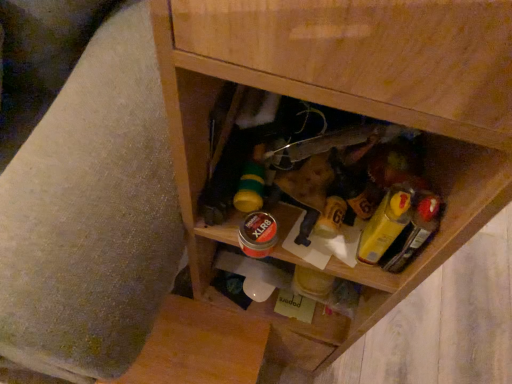
Question: Considering the relative sizes of yellow plastic mustard at center right and wooden swivel chair at lower right in the image provided, is yellow plastic mustard at center right taller than wooden swivel chair at lower right?

Choices:
 (A) no
 (B) yes

Answer: (A)

Question: Can you confirm if yellow plastic mustard at center right is wider than wooden swivel chair at lower right?

Choices:
 (A) yes
 (B) no

Answer: (B)

Question: Could you tell me if yellow plastic mustard at center right is turned towards wooden swivel chair at lower right?

Choices:
 (A) no
 (B) yes

Answer: (A)

Question: Is yellow plastic mustard at center right shorter than wooden swivel chair at lower right?

Choices:
 (A) yes
 (B) no

Answer: (A)

Question: Can you confirm if yellow plastic mustard at center right is bigger than wooden swivel chair at lower right?

Choices:
 (A) yes
 (B) no

Answer: (B)

Question: In terms of width, does wooden swivel chair at lower right look wider or thinner when compared to wooden cabinet at center?

Choices:
 (A) thin
 (B) wide

Answer: (B)

Question: Considering the positions of wooden swivel chair at lower right and wooden cabinet at center in the image, is wooden swivel chair at lower right bigger or smaller than wooden cabinet at center?

Choices:
 (A) big
 (B) small

Answer: (A)

Question: Do you think wooden swivel chair at lower right is within wooden cabinet at center, or outside of it?

Choices:
 (A) outside
 (B) inside

Answer: (A)

Question: In the image, is wooden swivel chair at lower right on the left side or the right side of wooden cabinet at center?

Choices:
 (A) left
 (B) right

Answer: (A)

Question: Would you say wooden cabinet at center is to the left or to the right of wooden swivel chair at lower right in the picture?

Choices:
 (A) left
 (B) right

Answer: (B)

Question: Choose the correct answer: Is wooden cabinet at center inside wooden swivel chair at lower right or outside it?

Choices:
 (A) inside
 (B) outside

Answer: (B)

Question: Does point (500, 8) appear closer or farther from the camera than point (57, 331)?

Choices:
 (A) closer
 (B) farther

Answer: (A)

Question: From a real-world perspective, is wooden cabinet at center positioned above or below wooden swivel chair at lower right?

Choices:
 (A) above
 (B) below

Answer: (A)

Question: In the image, is wooden swivel chair at lower right positioned in front of or behind yellow plastic mustard at center right?

Choices:
 (A) behind
 (B) front

Answer: (B)

Question: In terms of size, does wooden swivel chair at lower right appear bigger or smaller than yellow plastic mustard at center right?

Choices:
 (A) big
 (B) small

Answer: (A)